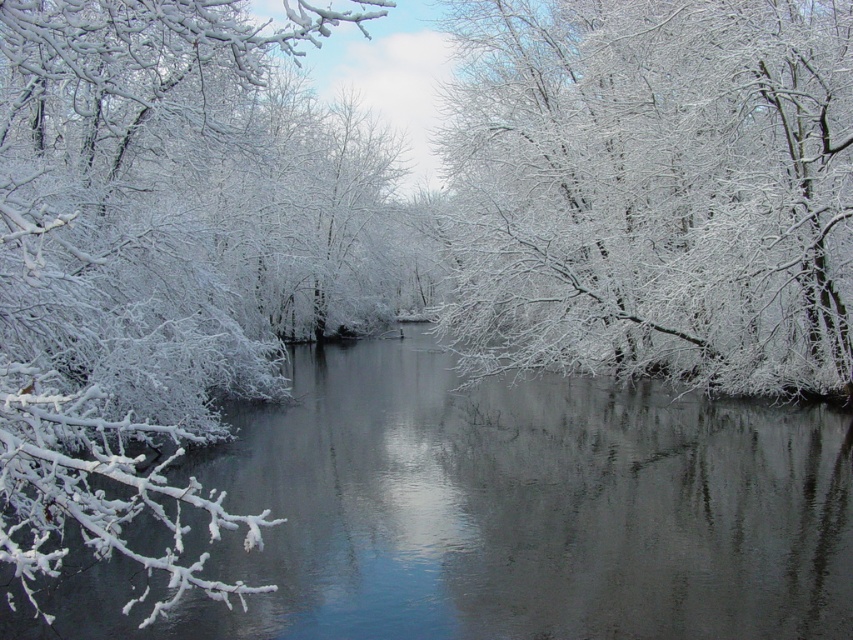
Question: Which object appears farthest from the camera in this image?

Choices:
 (A) white frosty branches at upper center
 (B) white frosty branches at left

Answer: (A)

Question: Which point is farther to the camera?

Choices:
 (A) (534, 214)
 (B) (251, 541)

Answer: (A)

Question: Does white frosty branches at upper center appear under white frosty branches at left?

Choices:
 (A) yes
 (B) no

Answer: (B)

Question: Is white frosty branches at upper center wider than white frosty branches at left?

Choices:
 (A) yes
 (B) no

Answer: (B)

Question: Is the position of white frosty branches at upper center less distant than that of white frosty branches at left?

Choices:
 (A) yes
 (B) no

Answer: (B)

Question: Which point is closer to the camera?

Choices:
 (A) white frosty branches at left
 (B) white frosty branches at upper center

Answer: (A)